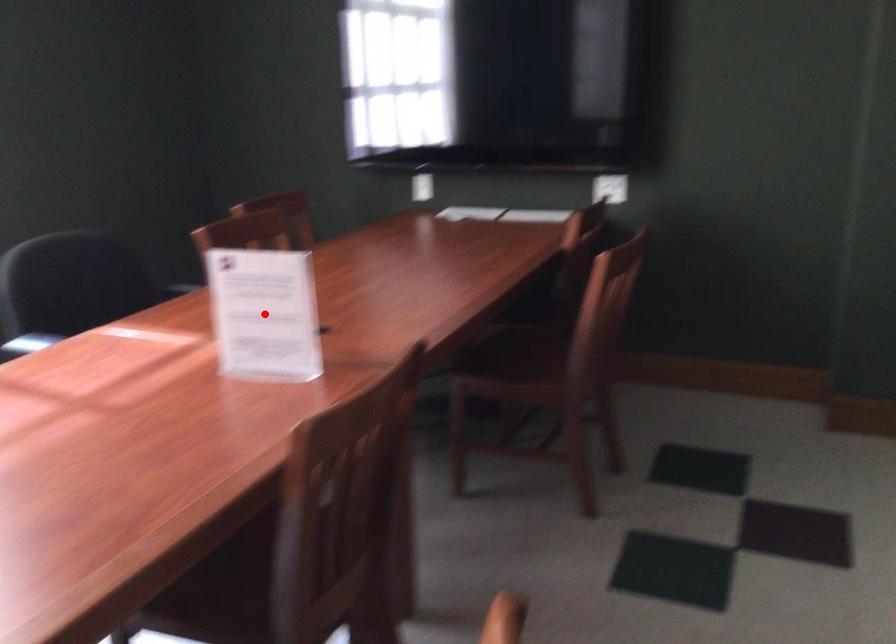
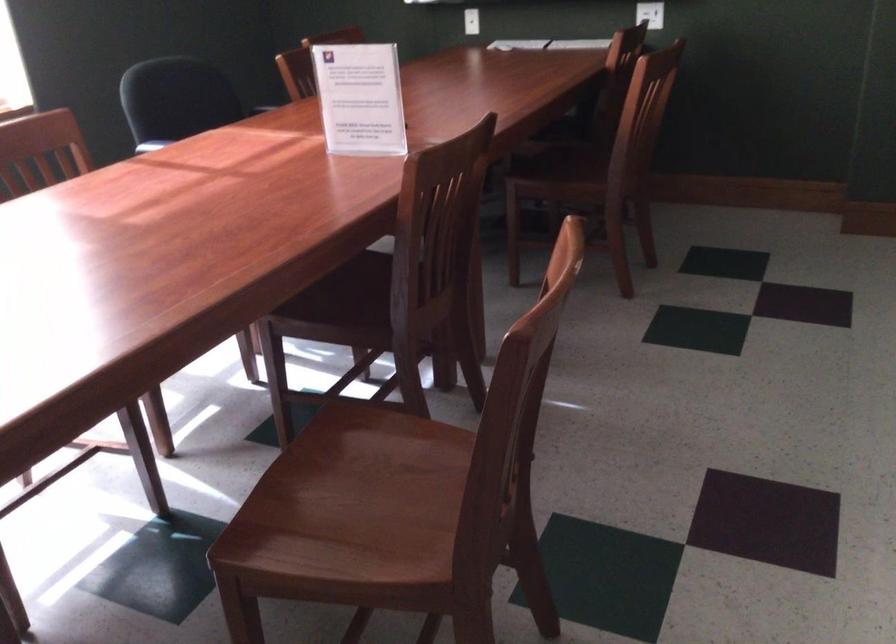
Where in the second image is the point corresponding to the highlighted location from the first image?

(359, 98)